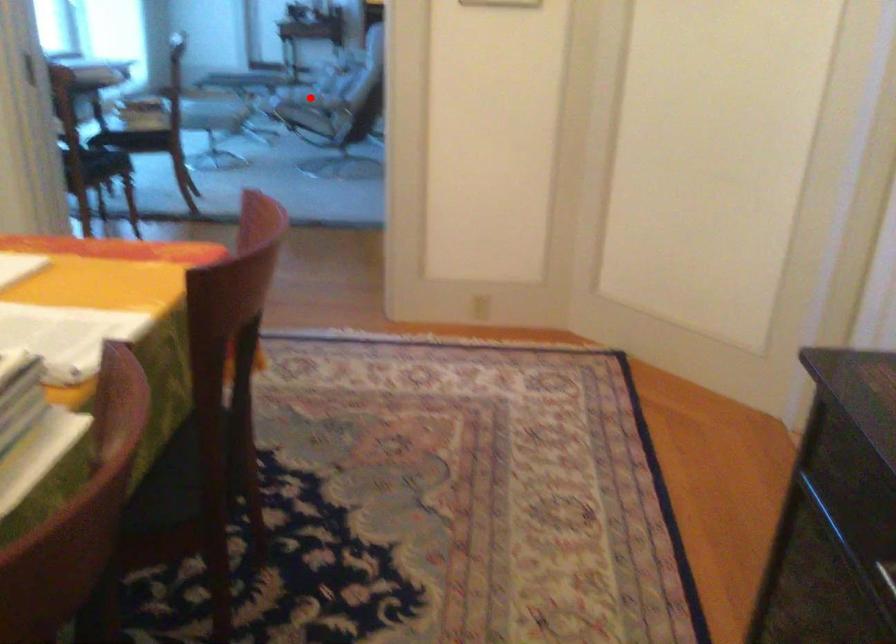
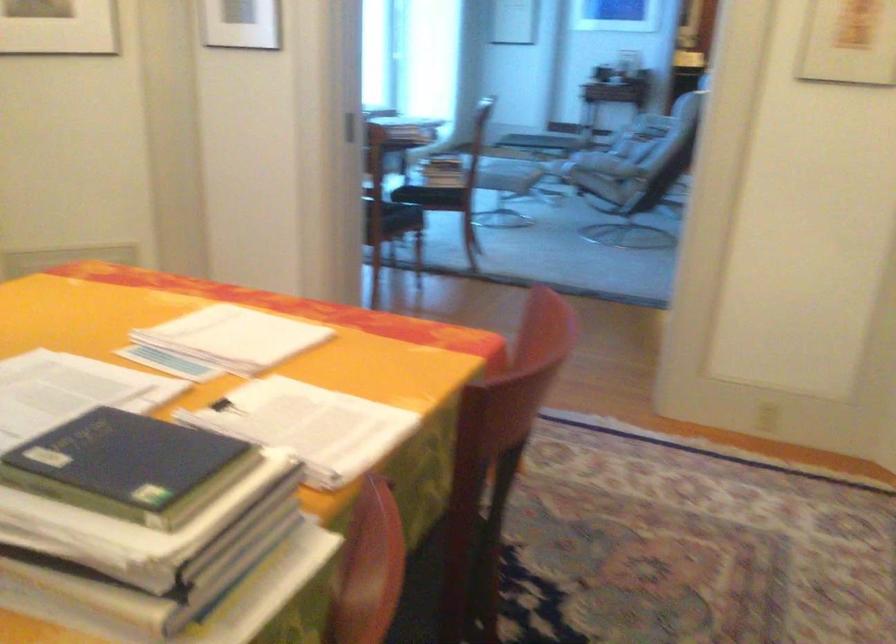
Question: I am providing you with two images of the same scene from different viewpoints. A red point is marked on the first image. Is the red point's position out of view in image 2?

Choices:
 (A) Yes
 (B) No

Answer: (B)